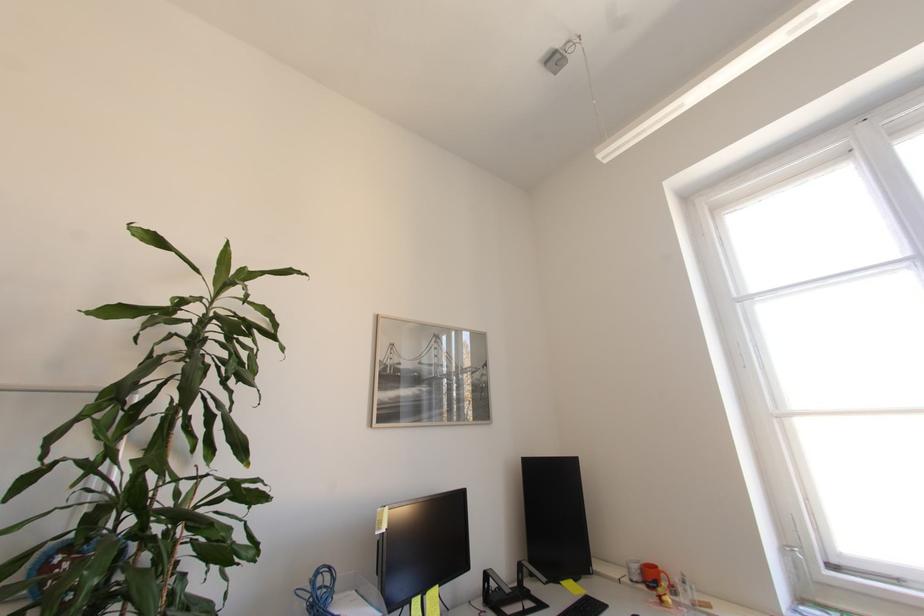
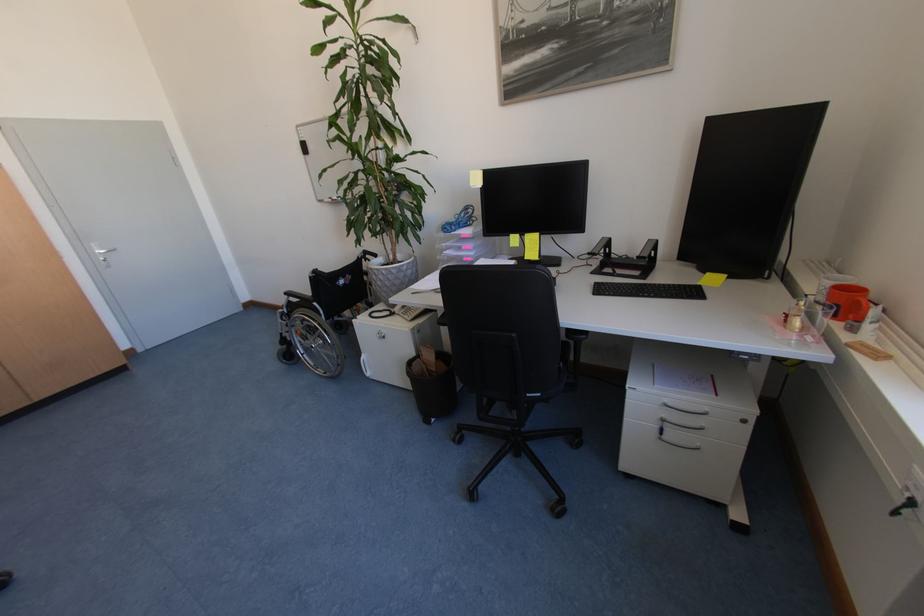
In the second image, find the point that corresponds to point (642, 581) in the first image.

(824, 300)